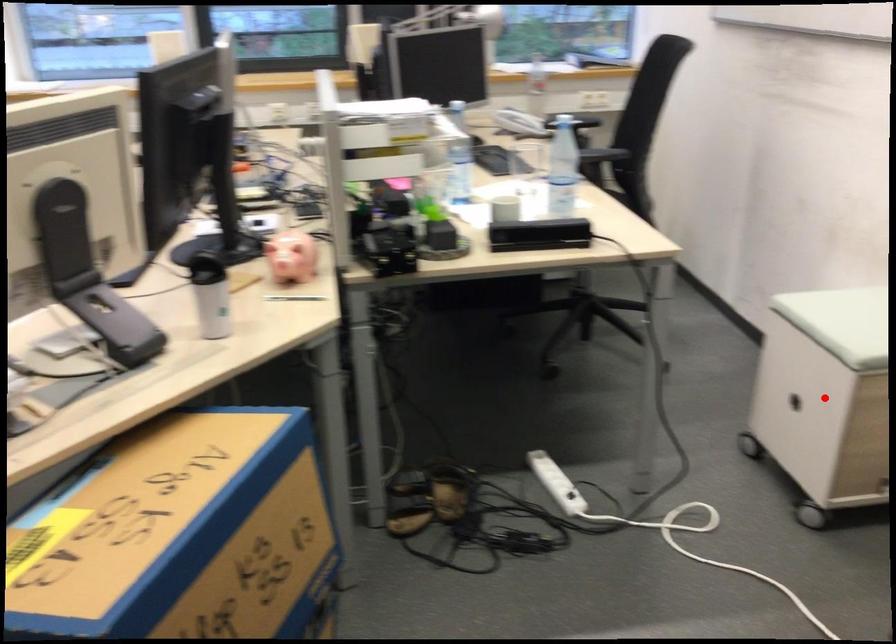
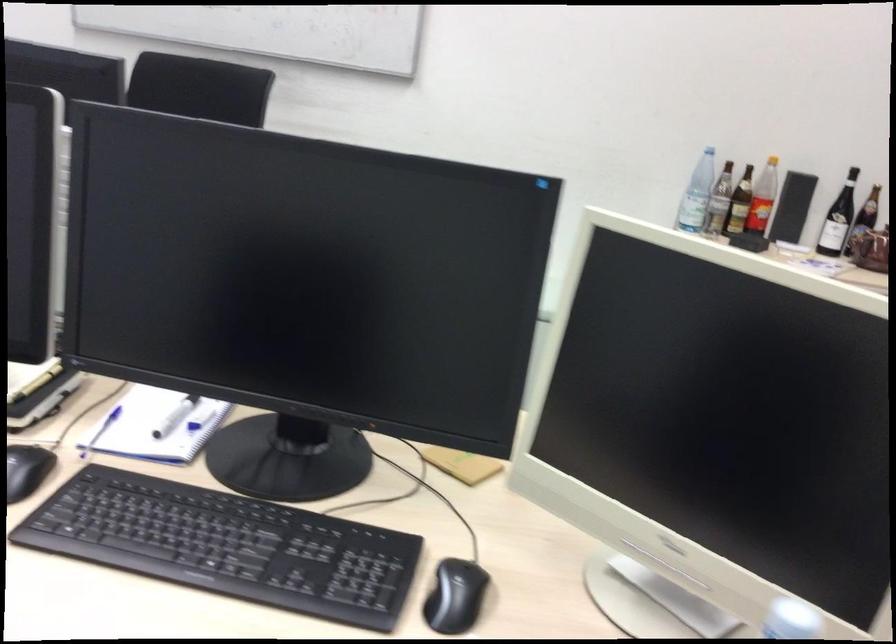
Question: I am providing you with two images of the same scene from different viewpoints. A red point is marked on the first image. At the location where the point appears in image 1, is it still visible in image 2?

Choices:
 (A) Yes
 (B) No

Answer: (B)